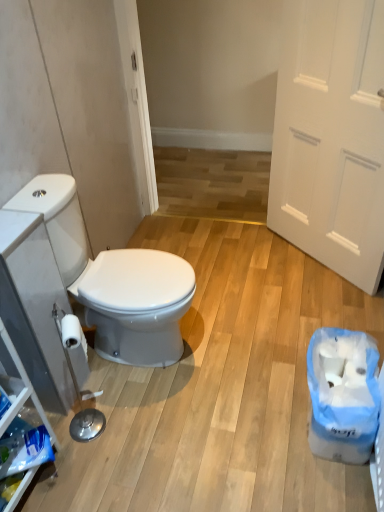
Question: Is white glossy toilet seat at left at the back of white matte door at right?

Choices:
 (A) no
 (B) yes

Answer: (A)

Question: Is the depth of white matte door at right greater than that of white glossy toilet seat at left?

Choices:
 (A) no
 (B) yes

Answer: (B)

Question: Is white matte door at right oriented towards white glossy toilet seat at left?

Choices:
 (A) yes
 (B) no

Answer: (A)

Question: Is white matte door at right not close to white glossy toilet seat at left?

Choices:
 (A) yes
 (B) no

Answer: (A)

Question: Considering the relative sizes of white matte door at right and white glossy toilet seat at left in the image provided, is white matte door at right taller than white glossy toilet seat at left?

Choices:
 (A) yes
 (B) no

Answer: (A)

Question: Looking at the image, does white glossy toilet seat at left seem bigger or smaller compared to white matte door at right?

Choices:
 (A) small
 (B) big

Answer: (B)

Question: Would you say white glossy toilet seat at left is to the left or to the right of white matte door at right in the picture?

Choices:
 (A) left
 (B) right

Answer: (A)

Question: From the image's perspective, is white glossy toilet seat at left positioned above or below white matte door at right?

Choices:
 (A) below
 (B) above

Answer: (A)

Question: Do you think white glossy toilet seat at left is within white matte door at right, or outside of it?

Choices:
 (A) outside
 (B) inside

Answer: (A)

Question: From the image's perspective, is blue plastic bag at lower right positioned above or below white glossy toilet seat at left?

Choices:
 (A) above
 (B) below

Answer: (B)

Question: Is point (327, 390) positioned closer to the camera than point (147, 289)?

Choices:
 (A) farther
 (B) closer

Answer: (B)

Question: In terms of height, does blue plastic bag at lower right look taller or shorter compared to white glossy toilet seat at left?

Choices:
 (A) short
 (B) tall

Answer: (A)

Question: Considering the positions of blue plastic bag at lower right and white glossy toilet seat at left in the image, is blue plastic bag at lower right bigger or smaller than white glossy toilet seat at left?

Choices:
 (A) small
 (B) big

Answer: (A)

Question: Relative to white matte door at right, is blue plastic bag at lower right in front or behind?

Choices:
 (A) behind
 (B) front

Answer: (B)

Question: Does point pos(317,374) appear closer or farther from the camera than point pos(372,128)?

Choices:
 (A) closer
 (B) farther

Answer: (A)